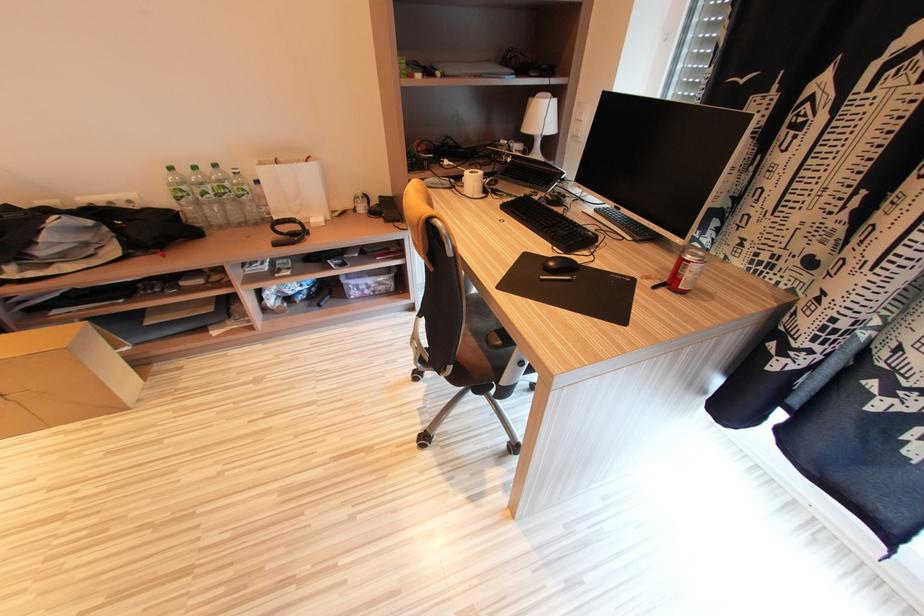
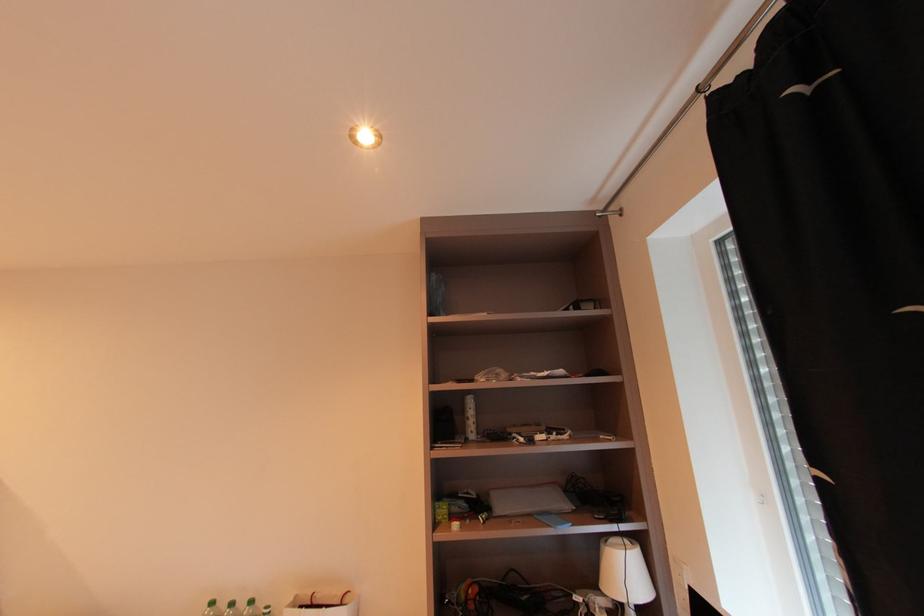
First-person continuous shooting, in which direction is the camera rotating?

The camera rotated toward left-up.